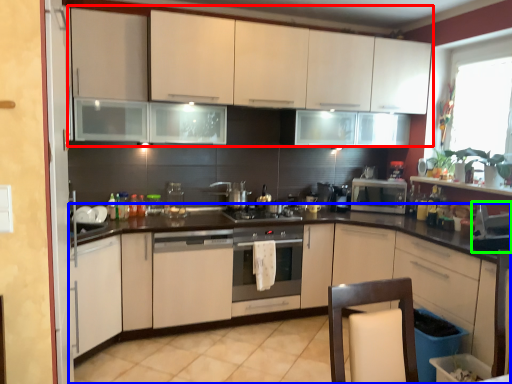
Question: Based on their relative distances, which object is nearer to cabinetry (highlighted by a red box)? Choose from cabinetry (highlighted by a blue box) and appliance (highlighted by a green box).

Choices:
 (A) cabinetry
 (B) appliance

Answer: (A)